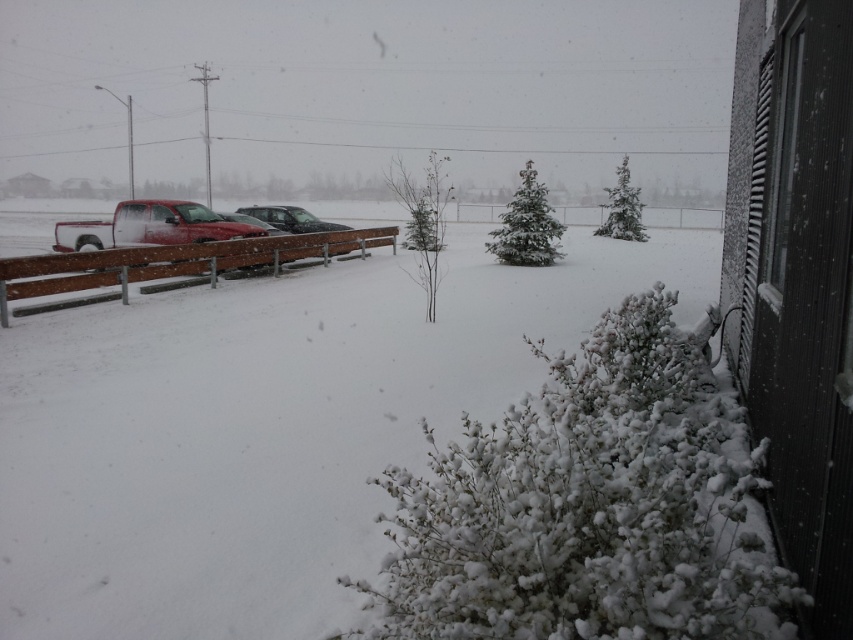
Question: Is matte red truck at left bigger than sleek silver sedan at center?

Choices:
 (A) no
 (B) yes

Answer: (A)

Question: Among these objects, which one is farthest from the camera?

Choices:
 (A) matte red truck at left
 (B) sleek silver sedan at center

Answer: (B)

Question: Is matte red truck at left to the left of sleek silver sedan at center from the viewer's perspective?

Choices:
 (A) no
 (B) yes

Answer: (B)

Question: Can you confirm if matte red truck at left is thinner than sleek silver sedan at center?

Choices:
 (A) yes
 (B) no

Answer: (B)